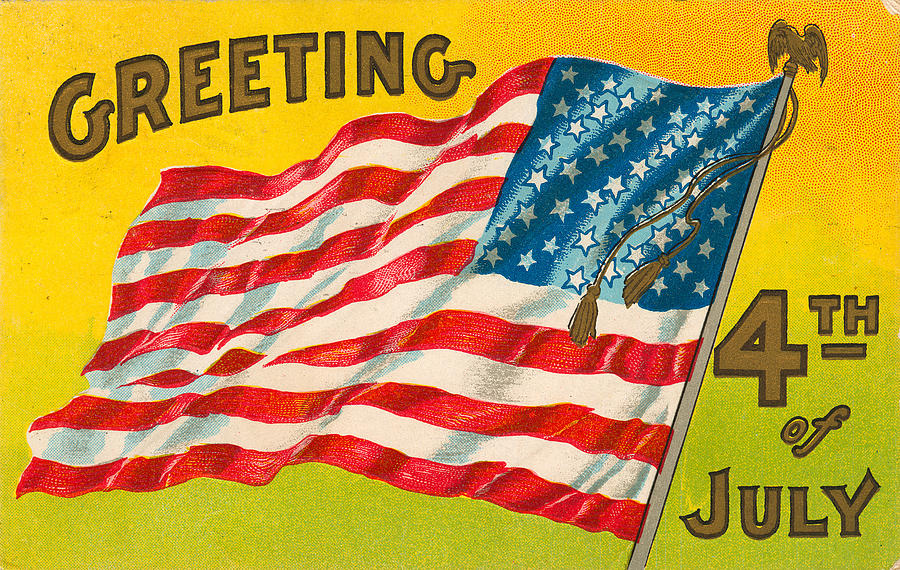
Locate an element on the screen. greeting text on the top of the painting is located at coordinates (295, 54).